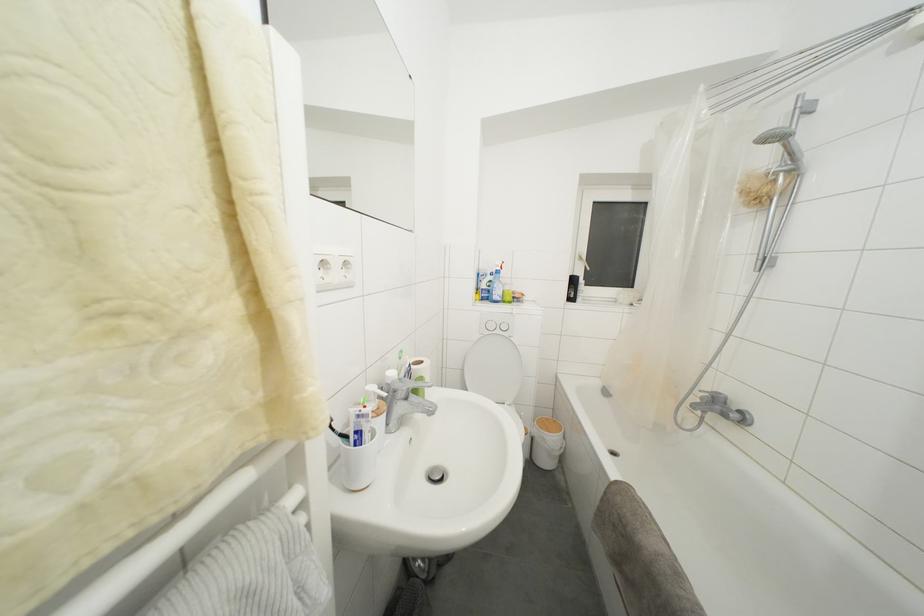
What do you see at coordinates (711, 395) in the screenshot? Image resolution: width=924 pixels, height=616 pixels. I see `a bathtub faucet handle` at bounding box center [711, 395].